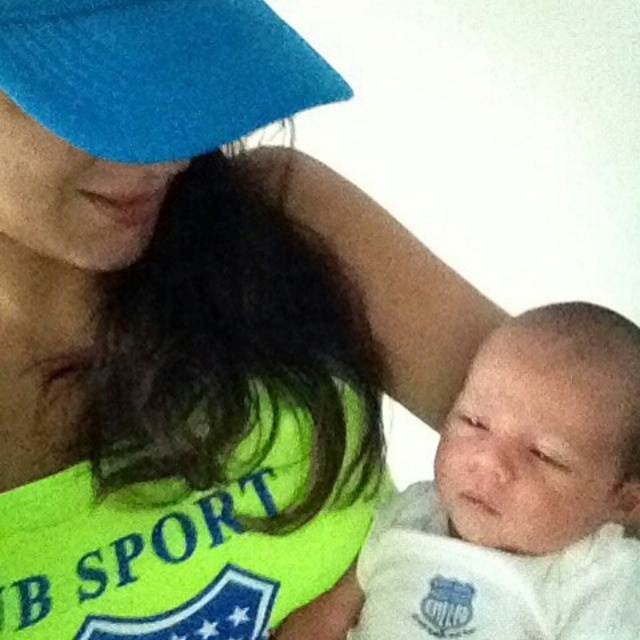
Question: Can you confirm if white soft cloth at center is positioned to the right of blue felt hat at upper left?

Choices:
 (A) no
 (B) yes

Answer: (B)

Question: Can you confirm if white soft cloth at center is bigger than blue felt hat at upper left?

Choices:
 (A) yes
 (B) no

Answer: (A)

Question: Which point is closer to the camera?

Choices:
 (A) blue felt hat at upper left
 (B) white soft cloth at center

Answer: (A)

Question: Which point is farther to the camera?

Choices:
 (A) blue felt hat at upper left
 (B) white soft cloth at center

Answer: (B)

Question: From the image, what is the correct spatial relationship of white soft cloth at center in relation to blue felt hat at upper left?

Choices:
 (A) below
 (B) above

Answer: (A)